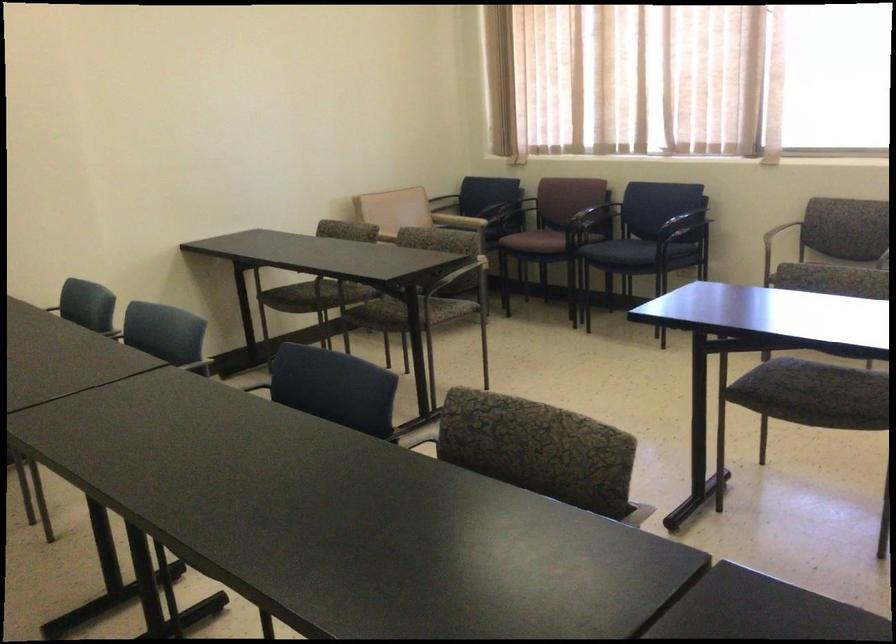
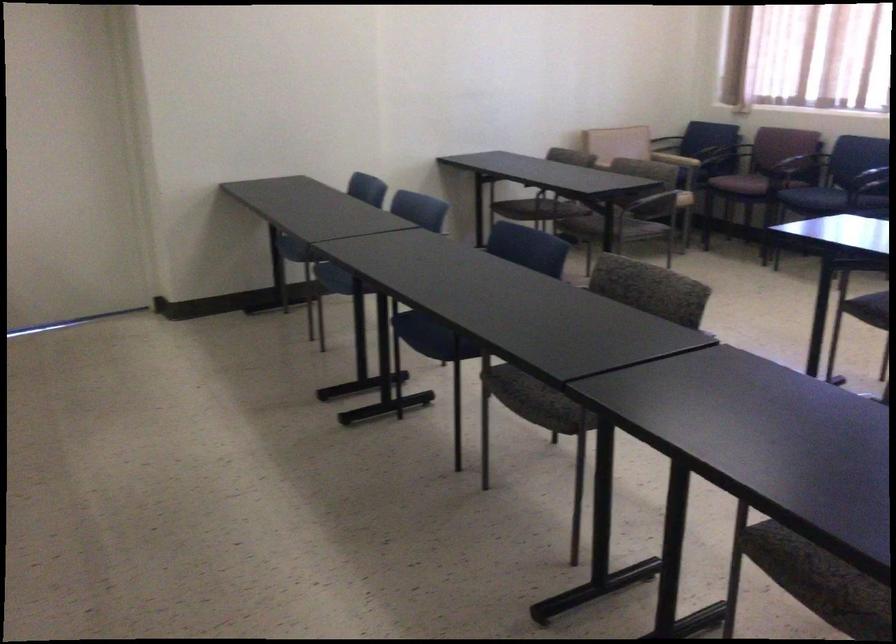
In the second image, find the point that corresponds to [746,395] in the first image.

(868, 308)